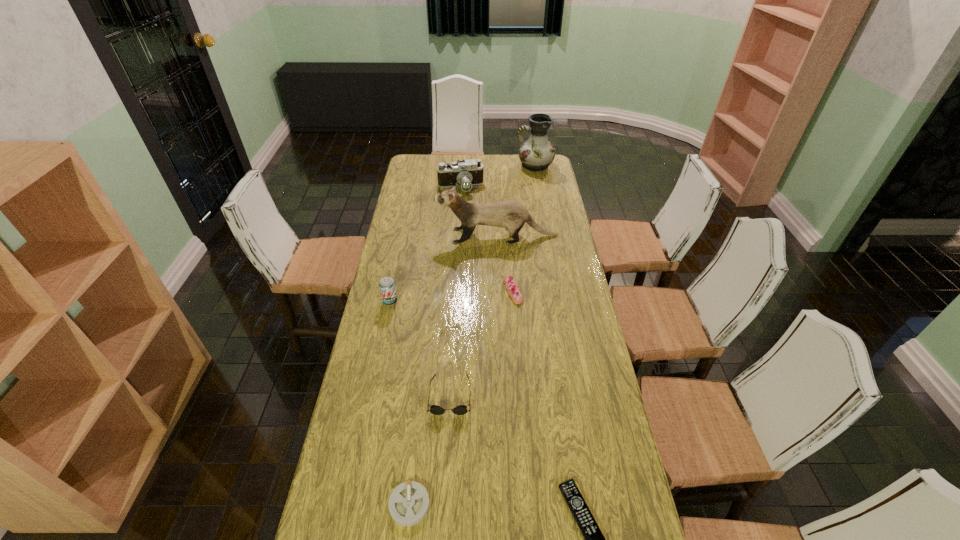
The width and height of the screenshot is (960, 540). In order to click on vacant area situated on the front of the vase in this screenshot , I will do `click(539, 188)`.

Identify the location of vacant space positioned on the face of the seventh shortest object. (390, 236).

Where is `free location located on the face of the seventh shortest object`? This screenshot has width=960, height=540. free location located on the face of the seventh shortest object is located at coordinates (414, 236).

Where is `vacant space located 0.080m on the face of the seventh shortest object`? The height and width of the screenshot is (540, 960). vacant space located 0.080m on the face of the seventh shortest object is located at coordinates (419, 236).

Locate an element on the screen. This screenshot has width=960, height=540. vacant space located at the lens of the second farthest object is located at coordinates (460, 207).

Locate an element on the screen. The height and width of the screenshot is (540, 960). free space located 0.210m on the right of the leftmost object is located at coordinates (455, 301).

Where is `vacant space positioned 0.140m on the front-facing side of the fourth shortest object`? vacant space positioned 0.140m on the front-facing side of the fourth shortest object is located at coordinates (446, 464).

At what (x,y) coordinates should I click in order to perform the action: click on free space located 0.400m on the front of the eclair. Please return your answer as a coordinate pair (x, y). The height and width of the screenshot is (540, 960). Looking at the image, I should click on (521, 404).

In order to click on vacant space located on the right of the ashtray in this screenshot , I will do `click(542, 504)`.

I want to click on object at the far edge, so click(537, 153).